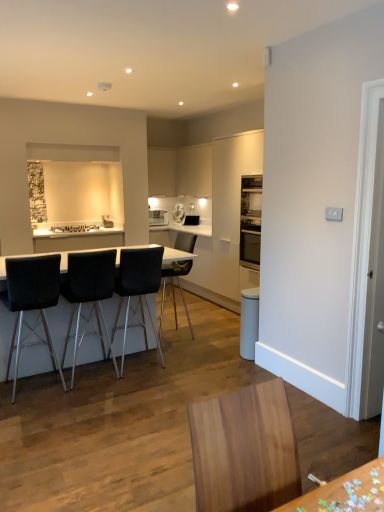
Locate an element on the screen. The width and height of the screenshot is (384, 512). vacant space in front of black leather chair at center, which is counted as the third chair, starting from the right is located at coordinates (91, 399).